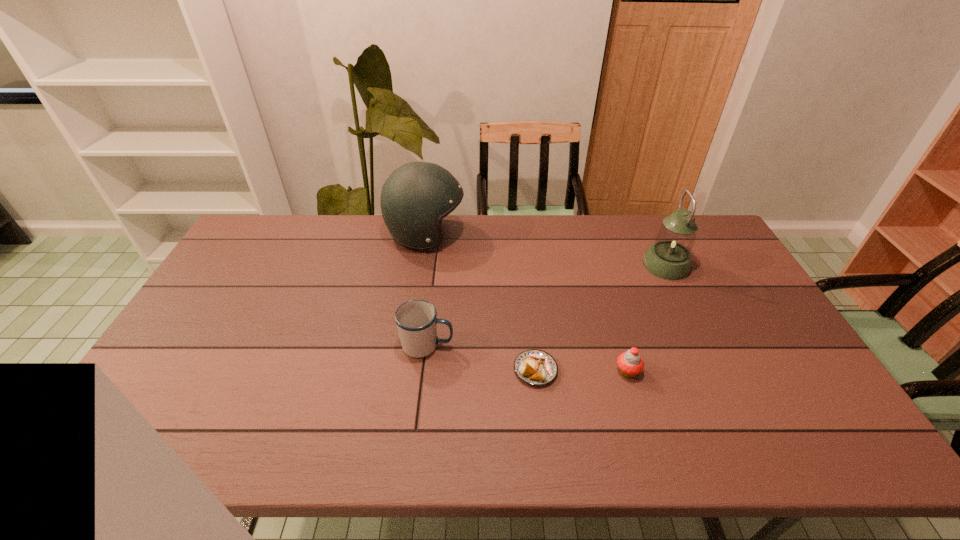
Where is `free spot located 0.350m on the left of the second object from right to left`? free spot located 0.350m on the left of the second object from right to left is located at coordinates (482, 371).

The height and width of the screenshot is (540, 960). Identify the location of vacant area located on the right of the third object from left to right. (599, 370).

This screenshot has height=540, width=960. What are the coordinates of `football helmet that is positioned at the far edge` in the screenshot? It's located at (415, 198).

Locate an element on the screen. Image resolution: width=960 pixels, height=540 pixels. lantern at the far edge is located at coordinates 669,258.

Where is `object that is at the right edge`? object that is at the right edge is located at coordinates (669, 258).

Where is `object present at the far right corner`? object present at the far right corner is located at coordinates (669, 258).

In the image, there is a desktop. Find the location of `free region at the far edge`. free region at the far edge is located at coordinates (608, 250).

You are a GUI agent. You are given a task and a screenshot of the screen. Output one action in this format:
    pyautogui.click(x=<x>, y=<y>)
    Task: Click on the vacant area at the left edge of the desktop
    The height and width of the screenshot is (540, 960).
    Given the screenshot: What is the action you would take?
    pyautogui.click(x=212, y=326)

This screenshot has width=960, height=540. What are the coordinates of `vacant region at the right edge` in the screenshot? It's located at (778, 356).

Locate an element on the screen. The image size is (960, 540). free space at the far left corner of the desktop is located at coordinates (243, 242).